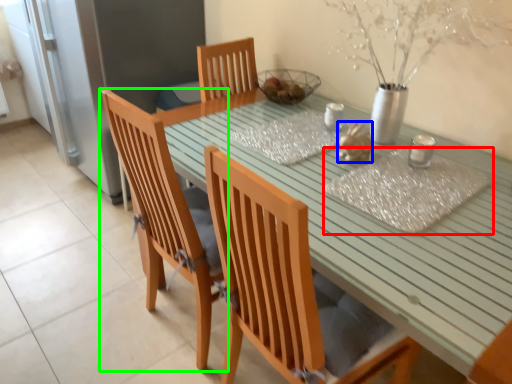
Question: Based on their relative distances, which object is nearer to place mat (highlighted by a red box)? Choose from food (highlighted by a blue box) and chair (highlighted by a green box).

Choices:
 (A) food
 (B) chair

Answer: (A)